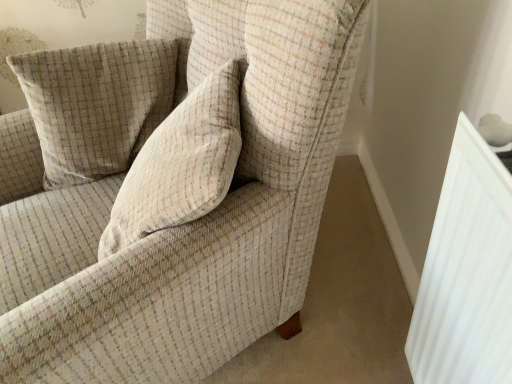
Question: Is beige textured cushion at upper left not near textured beige armchair at center?

Choices:
 (A) no
 (B) yes

Answer: (A)

Question: Is beige textured cushion at upper left at the right side of textured beige armchair at center?

Choices:
 (A) yes
 (B) no

Answer: (B)

Question: From the image's perspective, does beige textured cushion at upper left appear lower than textured beige armchair at center?

Choices:
 (A) no
 (B) yes

Answer: (A)

Question: From a real-world perspective, is beige textured cushion at upper left physically below textured beige armchair at center?

Choices:
 (A) yes
 (B) no

Answer: (B)

Question: Considering the relative sizes of beige textured cushion at upper left and textured beige armchair at center in the image provided, is beige textured cushion at upper left bigger than textured beige armchair at center?

Choices:
 (A) yes
 (B) no

Answer: (B)

Question: Considering their positions, is textured beige armchair at center located in front of or behind white ribbed radiator at right?

Choices:
 (A) front
 (B) behind

Answer: (A)

Question: Considering the positions of textured beige armchair at center and white ribbed radiator at right in the image, is textured beige armchair at center taller or shorter than white ribbed radiator at right?

Choices:
 (A) short
 (B) tall

Answer: (B)

Question: Considering the positions of textured beige armchair at center and white ribbed radiator at right in the image, is textured beige armchair at center wider or thinner than white ribbed radiator at right?

Choices:
 (A) thin
 (B) wide

Answer: (B)

Question: Based on their positions, is textured beige armchair at center located to the left or right of white ribbed radiator at right?

Choices:
 (A) left
 (B) right

Answer: (A)

Question: Which is correct: beige textured cushion at upper left is inside white ribbed radiator at right, or outside of it?

Choices:
 (A) inside
 (B) outside

Answer: (B)

Question: From the image's perspective, is beige textured cushion at upper left positioned above or below white ribbed radiator at right?

Choices:
 (A) below
 (B) above

Answer: (B)

Question: From a real-world perspective, relative to white ribbed radiator at right, is beige textured cushion at upper left vertically above or below?

Choices:
 (A) above
 (B) below

Answer: (A)

Question: From their relative heights in the image, would you say beige textured cushion at upper left is taller or shorter than white ribbed radiator at right?

Choices:
 (A) short
 (B) tall

Answer: (A)

Question: From a real-world perspective, is beige textured cushion at upper left physically located above or below textured beige armchair at center?

Choices:
 (A) above
 (B) below

Answer: (A)

Question: Looking at the image, does beige textured cushion at upper left seem bigger or smaller compared to textured beige armchair at center?

Choices:
 (A) small
 (B) big

Answer: (A)